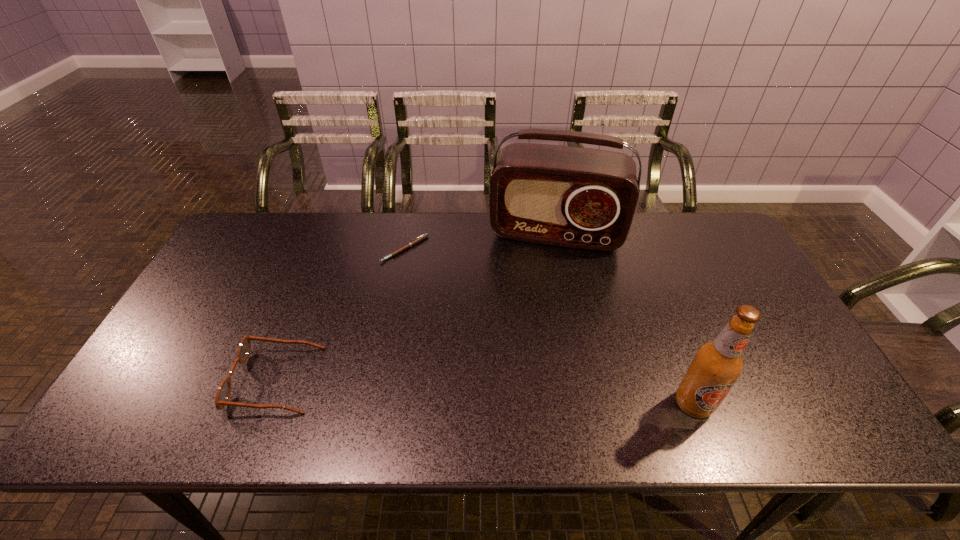
Find the location of a particular element. The width and height of the screenshot is (960, 540). the third tallest object is located at coordinates (223, 393).

Locate an element on the screen. spectacles is located at coordinates pyautogui.click(x=223, y=393).

Locate an element on the screen. The image size is (960, 540). beer bottle is located at coordinates (718, 364).

At what (x,y) coordinates should I click in order to perform the action: click on the shortest object. Please return your answer as a coordinate pair (x, y). Looking at the image, I should click on (423, 236).

Where is `the second object from left to right`? The image size is (960, 540). the second object from left to right is located at coordinates (423, 236).

Image resolution: width=960 pixels, height=540 pixels. Identify the location of radio receiver. (582, 198).

Image resolution: width=960 pixels, height=540 pixels. What are the coordinates of `free space located 0.220m on the front-facing side of the leftmost object` in the screenshot? It's located at (146, 380).

The width and height of the screenshot is (960, 540). I want to click on free space located on the front-facing side of the leftmost object, so [170, 380].

Locate an element on the screen. Image resolution: width=960 pixels, height=540 pixels. vacant region located on the front-facing side of the leftmost object is located at coordinates (170, 380).

Identify the location of free space located at the nib of the third object from right to left. (414, 327).